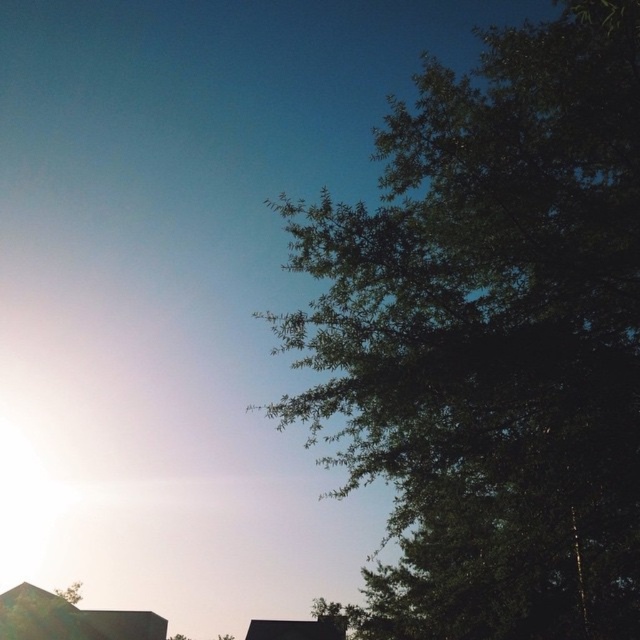
You are a bird looking for a place to perch. You see the green leafy tree at right and the green leafy tree at lower left. Which tree would provide a larger area for nesting?

The green leafy tree at right is bigger than the green leafy tree at lower left, so it would provide a larger area for nesting.